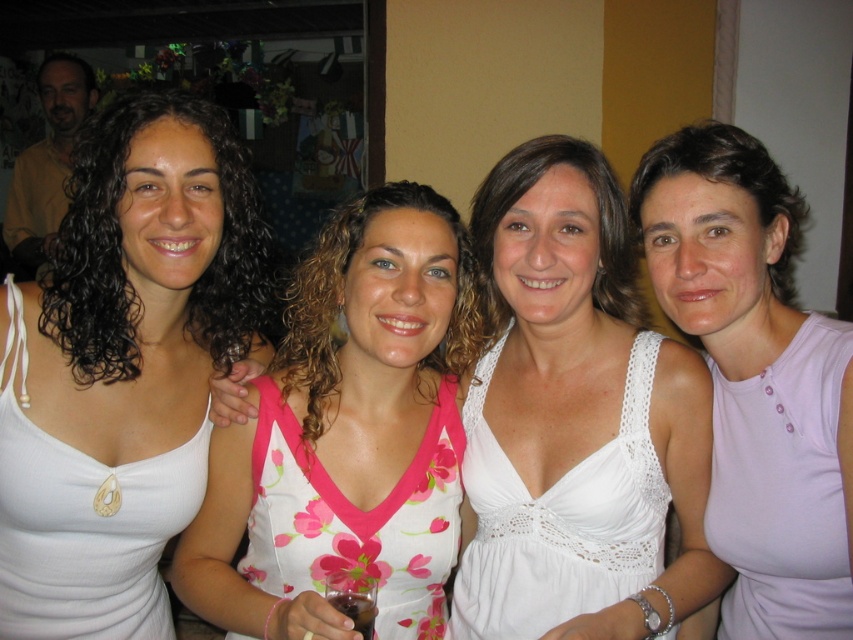
You are a photographer trying to capture a closeup of the purple matte tank top at right and the pink fabric tank top at right. Given that your camera can only focus on objects within 1.5 inches of each other, will both items be in focus?

The distance between the purple matte tank top at right and pink fabric tank top at right is 1.44 inches, which is within the 1.5 inch focus range. Therefore, both items will be in focus.

You are standing in the group of four women and want to move from your current position to the point marked as point (x=491, y=632). However, there is an obstacle at point (x=601, y=476). Will you be able to reach your destination without going around the obstacle?

Point (x=601, y=476) is in front of point (x=491, y=632), so the obstacle at point (x=601, y=476) is blocking the path to the destination. You will need to go around the obstacle to reach point (x=491, y=632).